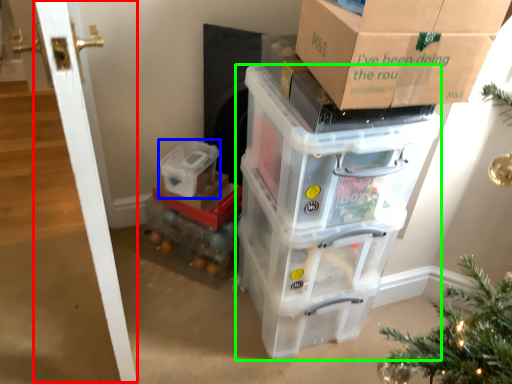
Question: Considering the real-world distances, which object is farthest from door (highlighted by a red box)? storage box (highlighted by a blue box) or storage box (highlighted by a green box)?

Choices:
 (A) storage box
 (B) storage box

Answer: (A)